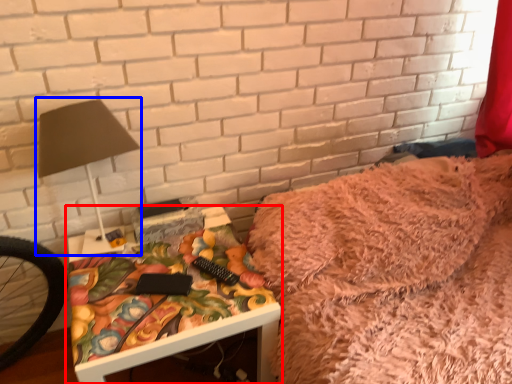
Question: Which of the following is the farthest to the observer, table (highlighted by a red box) or table lamp (highlighted by a blue box)?

Choices:
 (A) table
 (B) table lamp

Answer: (A)